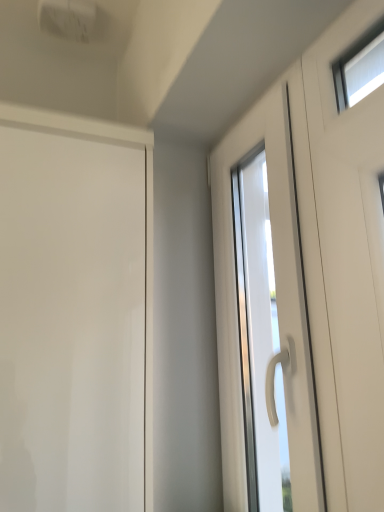
Question: In the image, is glossy white door at left, the 2th door from the right, positioned in front of or behind white glossy door at center, which is the 2th door from left to right?

Choices:
 (A) front
 (B) behind

Answer: (A)

Question: Is point (109, 392) closer or farther from the camera than point (228, 287)?

Choices:
 (A) closer
 (B) farther

Answer: (A)

Question: From the image's perspective, is glossy white door at left, which ranks as the first door in left-to-right order, located above or below white glossy door at center, the 1th door viewed from the right?

Choices:
 (A) above
 (B) below

Answer: (B)

Question: Is white glossy door at center, the 1th door viewed from the right, inside the boundaries of glossy white door at left, which ranks as the first door in left-to-right order, or outside?

Choices:
 (A) outside
 (B) inside

Answer: (A)

Question: Looking at their shapes, would you say white glossy door at center, which is the 2th door from left to right, is wider or thinner than glossy white door at left, the 2th door from the right?

Choices:
 (A) wide
 (B) thin

Answer: (B)

Question: Is point (296, 145) closer or farther from the camera than point (36, 327)?

Choices:
 (A) farther
 (B) closer

Answer: (A)

Question: Considering their positions, is white glossy door at center, the 1th door viewed from the right, located in front of or behind glossy white door at left, which ranks as the first door in left-to-right order?

Choices:
 (A) front
 (B) behind

Answer: (B)